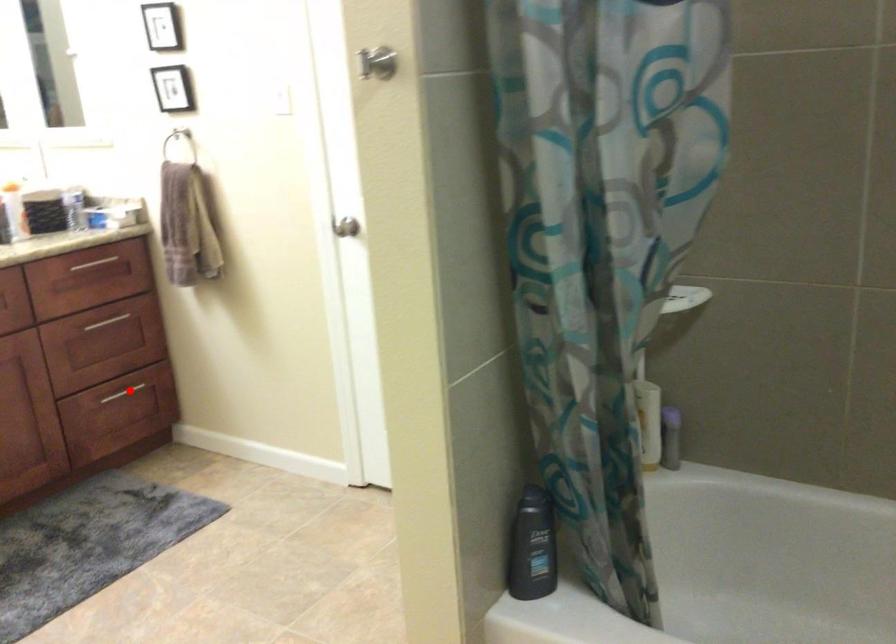
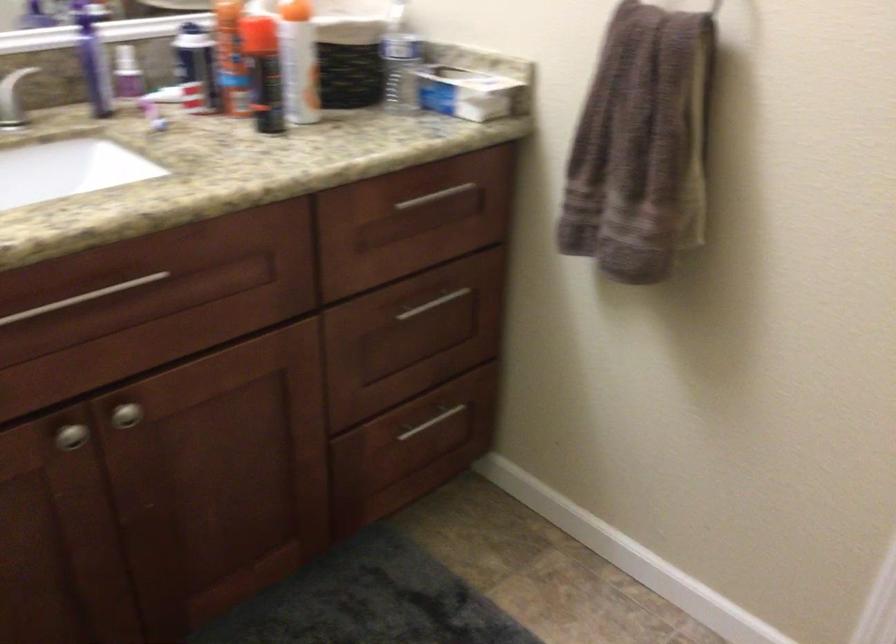
Question: I am providing you with two images of the same scene from different viewpoints. A red point is shown in image1. For the corresponding object point in image2, is it positioned nearer or farther from the camera?

Choices:
 (A) Nearer
 (B) Farther

Answer: (A)